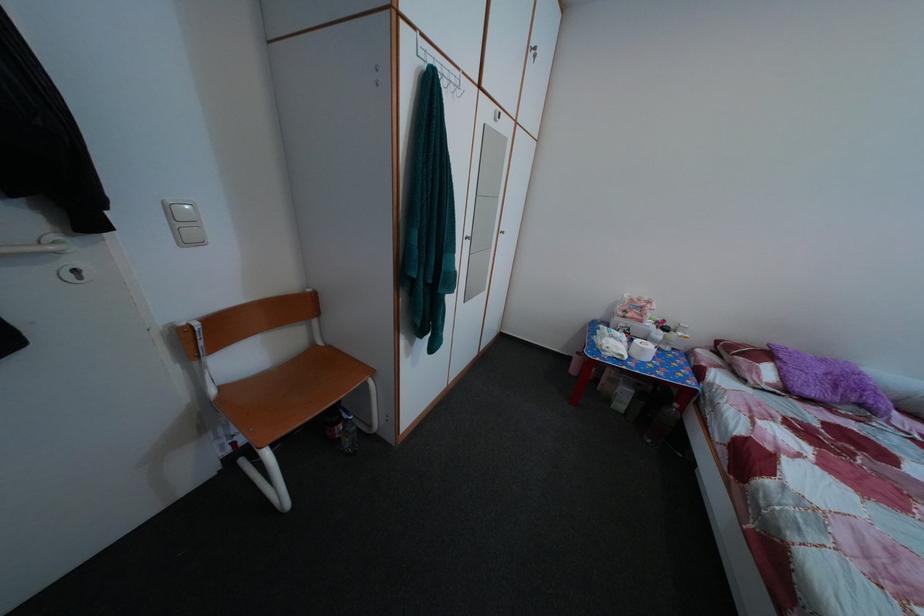
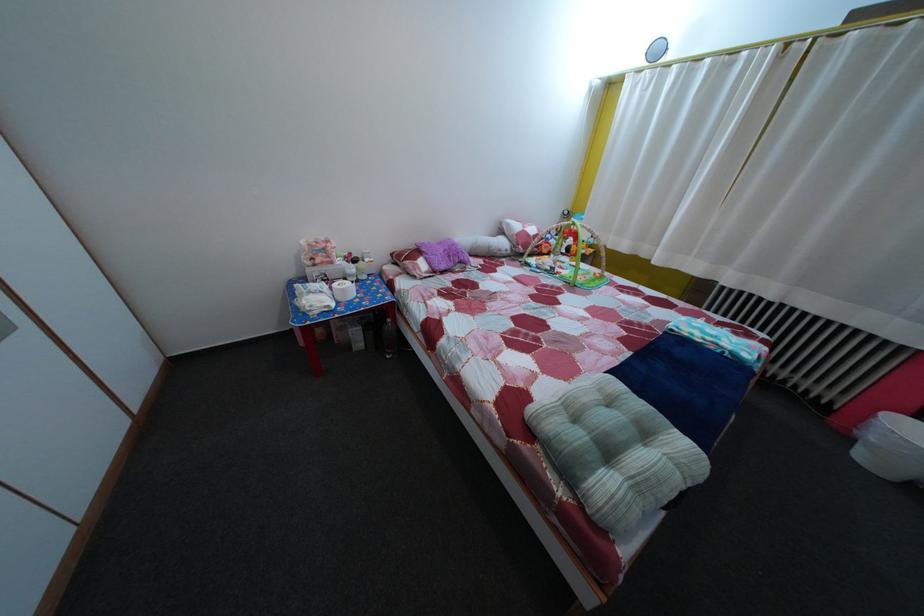
Locate, in the second image, the point that corresponds to point (832, 369) in the first image.

(450, 252)